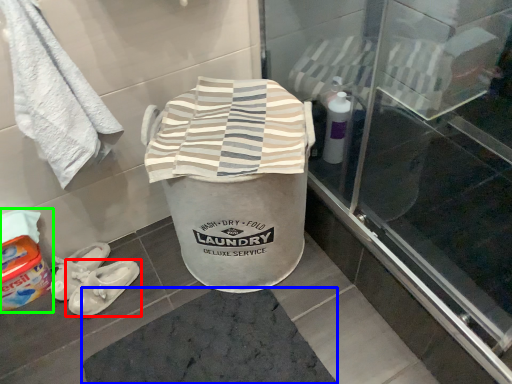
Question: Based on their relative distances, which object is nearer to footwear (highlighted by a red box)? Choose from bath mat (highlighted by a blue box) and wash (highlighted by a green box).

Choices:
 (A) bath mat
 (B) wash

Answer: (B)